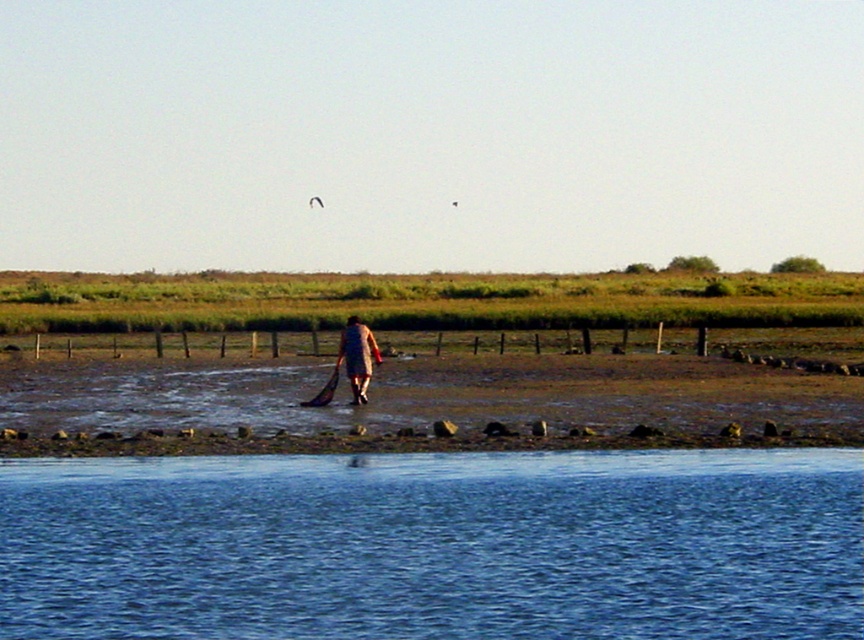
Question: Is blue liquid water at lower center to the right of brown leather jacket at center from the viewer's perspective?

Choices:
 (A) yes
 (B) no

Answer: (A)

Question: Is blue liquid water at lower center below brown leather jacket at center?

Choices:
 (A) no
 (B) yes

Answer: (B)

Question: Observing the image, what is the correct spatial positioning of blue liquid water at lower center in reference to brown leather jacket at center?

Choices:
 (A) left
 (B) right

Answer: (B)

Question: Among these points, which one is farthest from the camera?

Choices:
 (A) (346, 337)
 (B) (459, 470)

Answer: (A)